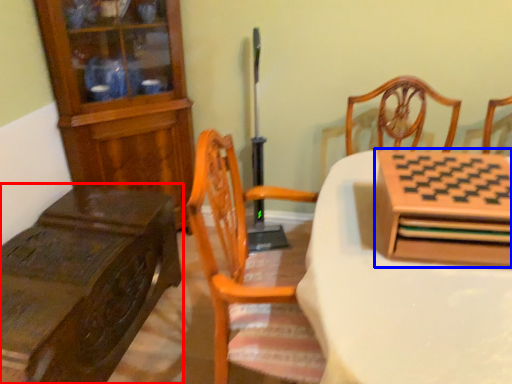
Question: Which point is further to the camera, table (highlighted by a red box) or cabinetry (highlighted by a blue box)?

Choices:
 (A) table
 (B) cabinetry

Answer: (A)